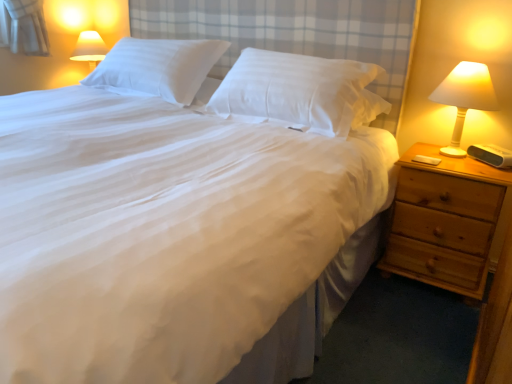
Question: Is white smooth pillow at center, the 2th pillow from the left, bigger or smaller than white smooth pillow at upper center, the 2th pillow in the right-to-left sequence?

Choices:
 (A) small
 (B) big

Answer: (B)

Question: Does point (367, 64) appear closer or farther from the camera than point (128, 76)?

Choices:
 (A) farther
 (B) closer

Answer: (B)

Question: Which object is the farthest from the white smooth pillow at upper center, the 2th pillow in the right-to-left sequence?

Choices:
 (A) light brown wooden nightstand at right
 (B) white smooth pillow at center, the 2th pillow from the left
 (C) white plastic lamp at right

Answer: (A)

Question: Which object is positioned farthest from the white smooth pillow at upper center, the first pillow from the left?

Choices:
 (A) white plastic lamp at right
 (B) white smooth pillow at center, the 2th pillow from the left
 (C) light brown wooden nightstand at right

Answer: (C)